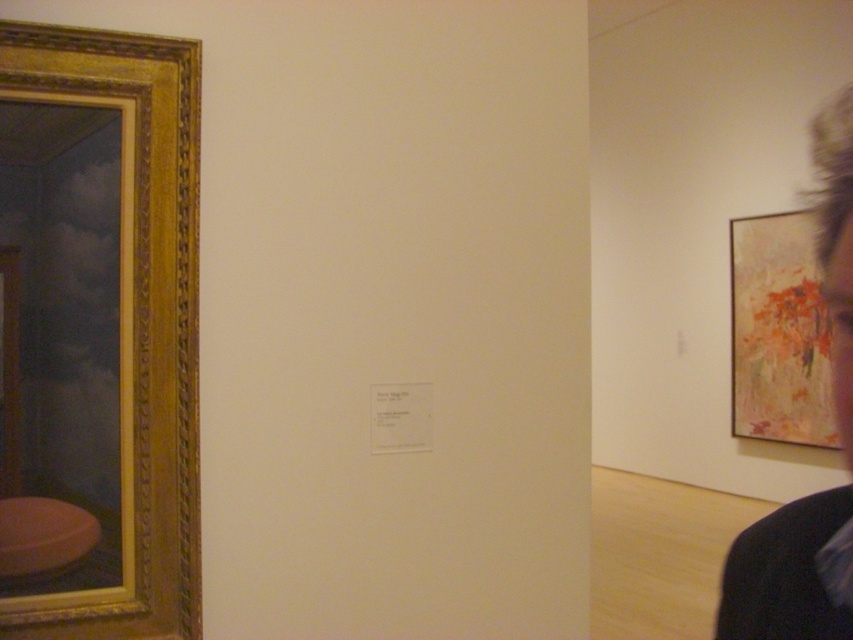
Can you confirm if gold ornate frame at left is smaller than dark hair at upper right?

Actually, gold ornate frame at left might be larger than dark hair at upper right.

Between point (126, 128) and point (846, 492), which one is positioned in front?

Positioned in front is point (846, 492).

Identify the location of gold ornate frame at left. (138, 320).

Is dark hair at upper right smaller than abstract painting at right?

Indeed, dark hair at upper right has a smaller size compared to abstract painting at right.

Which is behind, point (846, 592) or point (822, 433)?

Point (822, 433)

The width and height of the screenshot is (853, 640). Identify the location of dark hair at upper right. (791, 572).

Can you confirm if gold ornate frame at left is taller than abstract painting at right?

In fact, gold ornate frame at left may be shorter than abstract painting at right.

Between gold ornate frame at left and abstract painting at right, which one has more height?

abstract painting at right is taller.

Who is more distant from viewer, (173, 637) or (801, 282)?

Positioned behind is point (801, 282).

The image size is (853, 640). What are the coordinates of `gold ornate frame at left` in the screenshot? It's located at (138, 320).